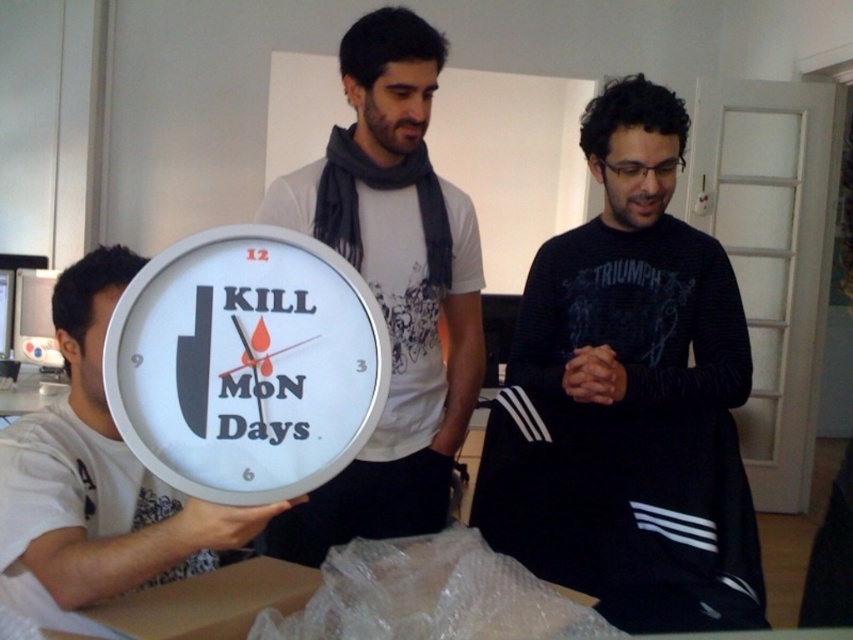
Who is higher up, white glossy clock at center or white matte clock at left?

white glossy clock at center is higher up.

Based on the photo, does white glossy clock at center have a greater width compared to white matte clock at left?

No, white glossy clock at center is not wider than white matte clock at left.

Find the location of a particular element. white glossy clock at center is located at coordinates (245, 364).

Does black matte sweater at center appear on the right side of white matte clock at center?

Result: Correct, you'll find black matte sweater at center to the right of white matte clock at center.

Is black matte sweater at center to the left of white matte clock at center from the viewer's perspective?

In fact, black matte sweater at center is to the right of white matte clock at center.

What do you see at coordinates (628, 397) in the screenshot? I see `black matte sweater at center` at bounding box center [628, 397].

You are a GUI agent. You are given a task and a screenshot of the screen. Output one action in this format:
    pyautogui.click(x=<x>, y=<y>)
    Task: Click on the black matte sweater at center
    The image size is (853, 640).
    Given the screenshot: What is the action you would take?
    pyautogui.click(x=628, y=397)

Is white matte clock at left further to the viewer compared to brown cardboard box at lower left?

That is False.

Between point (56, 611) and point (115, 604), which one is positioned behind?

Positioned behind is point (56, 611).

Does point (137, 472) come behind point (270, 577)?

Yes, it is.

This screenshot has width=853, height=640. In order to click on white matte clock at left in this screenshot , I will do `click(96, 481)`.